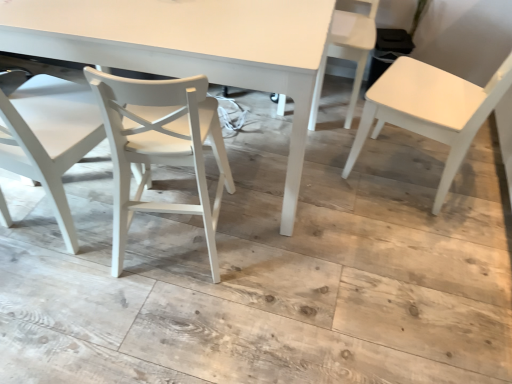
Question: Is white matte chair at left, which is counted as the fourth chair, starting from the right, oriented towards white matte chair at center, acting as the 3th chair starting from the right?

Choices:
 (A) yes
 (B) no

Answer: (B)

Question: From a real-world perspective, is white matte chair at left, marked as the first chair in a left-to-right arrangement, below white matte chair at center, marked as the second chair in a left-to-right arrangement?

Choices:
 (A) no
 (B) yes

Answer: (A)

Question: From the image's perspective, is white matte chair at left, marked as the first chair in a left-to-right arrangement, under white matte chair at center, marked as the second chair in a left-to-right arrangement?

Choices:
 (A) yes
 (B) no

Answer: (B)

Question: Is white matte chair at left, which is counted as the fourth chair, starting from the right, not near white matte chair at center, acting as the 3th chair starting from the right?

Choices:
 (A) yes
 (B) no

Answer: (B)

Question: Is white matte chair at left, which is counted as the fourth chair, starting from the right, in contact with white matte chair at center, acting as the 3th chair starting from the right?

Choices:
 (A) no
 (B) yes

Answer: (A)

Question: From a real-world perspective, is white plastic chair at upper right, the third chair positioned from the left, physically located above or below white matte chair at center, marked as the second chair in a left-to-right arrangement?

Choices:
 (A) below
 (B) above

Answer: (A)

Question: From the image's perspective, is white plastic chair at upper right, the 2th chair from the right, above or below white matte chair at center, marked as the second chair in a left-to-right arrangement?

Choices:
 (A) above
 (B) below

Answer: (A)

Question: Looking at the image, does white plastic chair at upper right, the third chair positioned from the left, seem bigger or smaller compared to white matte chair at center, marked as the second chair in a left-to-right arrangement?

Choices:
 (A) big
 (B) small

Answer: (B)

Question: Relative to white matte chair at center, acting as the 3th chair starting from the right, is white plastic chair at upper right, the 2th chair from the right, in front or behind?

Choices:
 (A) behind
 (B) front

Answer: (A)

Question: Would you say white matte chair at center, acting as the 3th chair starting from the right, is to the left or to the right of white matte table at center in the picture?

Choices:
 (A) left
 (B) right

Answer: (B)

Question: Looking at their shapes, would you say white matte chair at center, acting as the 3th chair starting from the right, is wider or thinner than white matte table at center?

Choices:
 (A) wide
 (B) thin

Answer: (B)

Question: From their relative heights in the image, would you say white matte chair at center, acting as the 3th chair starting from the right, is taller or shorter than white matte table at center?

Choices:
 (A) tall
 (B) short

Answer: (A)

Question: In the image, is white matte chair at center, marked as the second chair in a left-to-right arrangement, positioned in front of or behind white matte table at center?

Choices:
 (A) behind
 (B) front

Answer: (B)

Question: From a real-world perspective, relative to white matte chair at left, marked as the first chair in a left-to-right arrangement, is white plastic chair at upper right, the third chair positioned from the left, vertically above or below?

Choices:
 (A) above
 (B) below

Answer: (B)

Question: In the image, is white plastic chair at upper right, the third chair positioned from the left, positioned in front of or behind white matte chair at left, which is counted as the fourth chair, starting from the right?

Choices:
 (A) behind
 (B) front

Answer: (A)